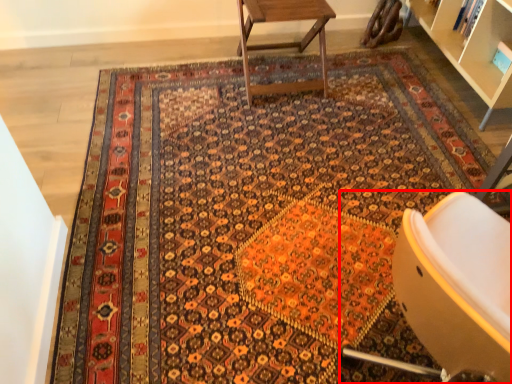
Question: Where is chair (annotated by the red box) located in relation to table in the image?

Choices:
 (A) right
 (B) left

Answer: (A)